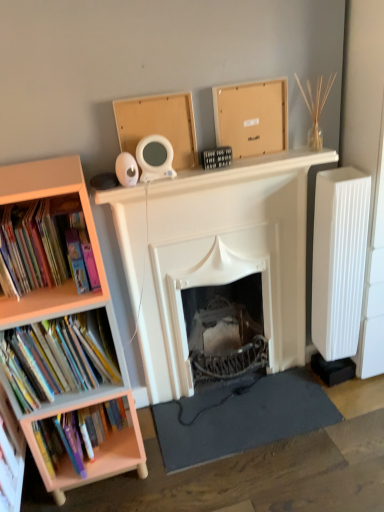
The image size is (384, 512). In order to click on free space that is in between peach wood bookcase at left and dark gray rubber mat at lower center in this screenshot , I will do `click(198, 460)`.